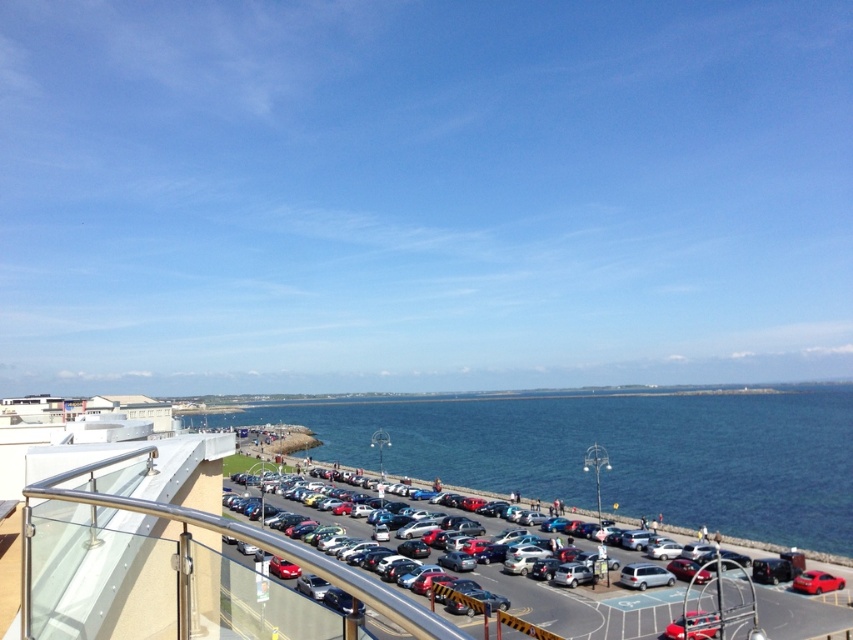
Question: Is blue water at center below metallic cars at center?

Choices:
 (A) no
 (B) yes

Answer: (B)

Question: Which is farther from the shiny red car at lower right?

Choices:
 (A) metallic cars at center
 (B) blue water at center

Answer: (B)

Question: Is blue water at center below metallic cars at center?

Choices:
 (A) no
 (B) yes

Answer: (B)

Question: Considering the real-world distances, which object is farthest from the shiny red car at lower right?

Choices:
 (A) metallic cars at center
 (B) blue water at center

Answer: (B)

Question: Based on their relative distances, which object is nearer to the blue water at center?

Choices:
 (A) shiny red car at lower right
 (B) metallic cars at center

Answer: (B)

Question: Is blue water at center above shiny red car at lower right?

Choices:
 (A) no
 (B) yes

Answer: (A)